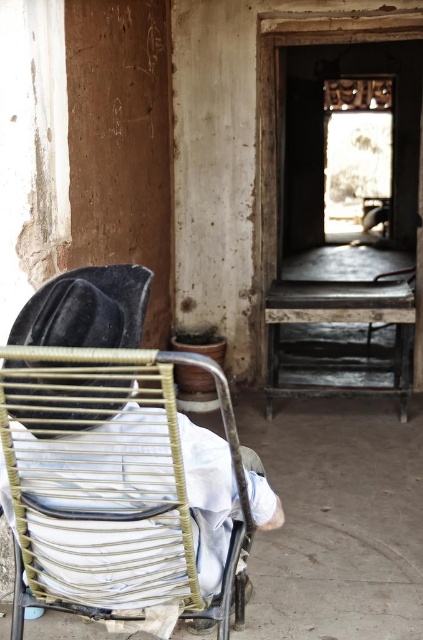
Can you confirm if woven wood rocking chair at center is wider than velvet black hat at upper left?

Yes, woven wood rocking chair at center is wider than velvet black hat at upper left.

Between woven wood rocking chair at center and velvet black hat at upper left, which one is positioned higher?

velvet black hat at upper left is higher up.

What do you see at coordinates (88, 428) in the screenshot? The image size is (423, 640). I see `woven wood rocking chair at center` at bounding box center [88, 428].

Where is `woven wood rocking chair at center`? This screenshot has height=640, width=423. woven wood rocking chair at center is located at coordinates (88, 428).